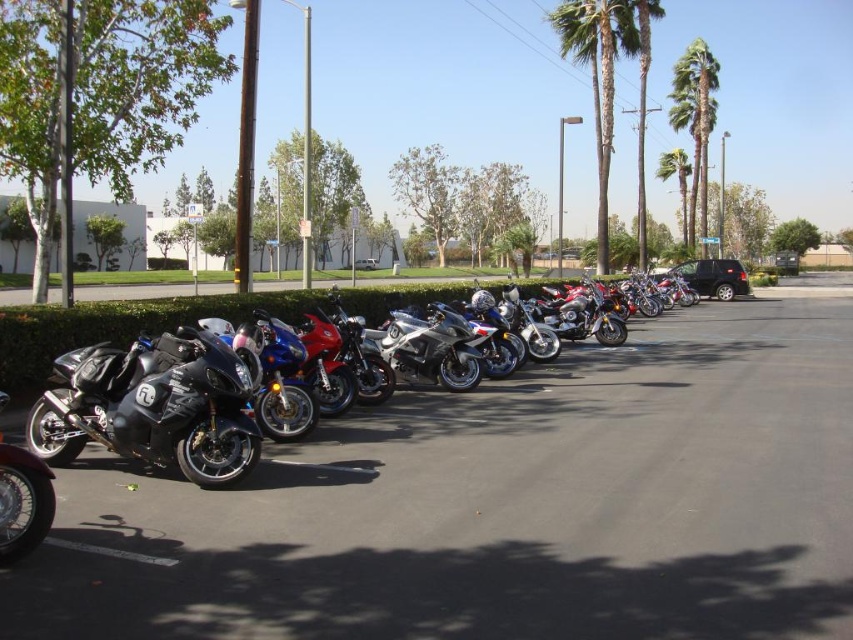
Question: Which is nearer to the silver metallic sportbike at center?

Choices:
 (A) green leafy palm trees at upper right
 (B) green leafy palm tree at upper center
 (C) green leafy palm tree at center-right
 (D) metallic motorcycles at center

Answer: (D)

Question: Does metallic motorcycles at center have a greater width compared to green leafy palm tree at upper right?

Choices:
 (A) yes
 (B) no

Answer: (B)

Question: Which point is closer to the camera taking this photo?

Choices:
 (A) (701, 150)
 (B) (556, 8)

Answer: (B)

Question: Estimate the real-world distances between objects in this image. Which object is closer to the shiny black motorcycle at left?

Choices:
 (A) green leafy palm tree at center-right
 (B) green leafy palm tree at upper center
 (C) metallic motorcycles at center

Answer: (C)

Question: Can you confirm if green leafy palm trees at upper right is positioned to the right of green leafy palm tree at center-right?

Choices:
 (A) no
 (B) yes

Answer: (B)

Question: Can you confirm if green leafy palm tree at upper center is positioned below green leafy palm tree at upper right?

Choices:
 (A) no
 (B) yes

Answer: (B)